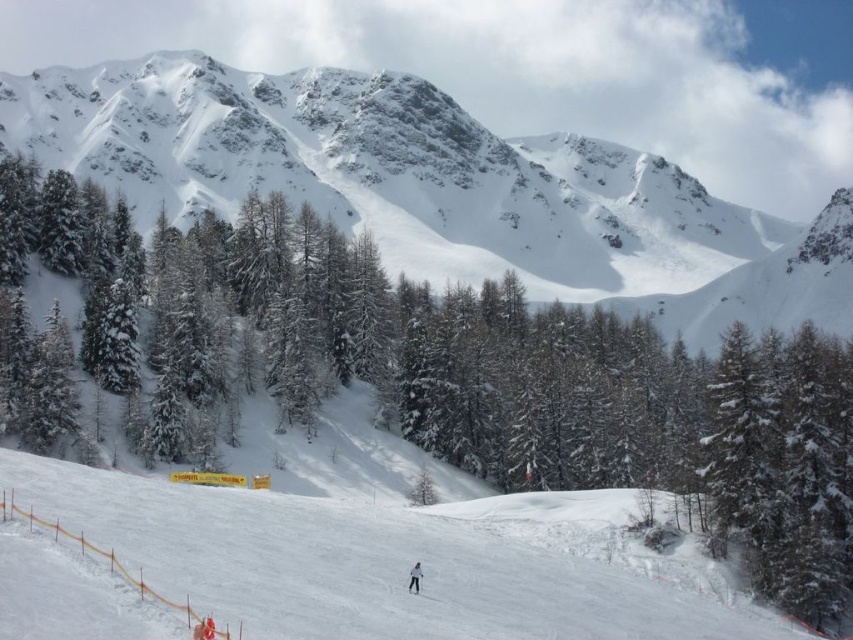
Is snowy granite mountain at upper center taller than white snow ski slope at lower center?

Yes, snowy granite mountain at upper center is taller than white snow ski slope at lower center.

Does snowy granite mountain at upper center have a lesser height compared to white snow ski slope at lower center?

In fact, snowy granite mountain at upper center may be taller than white snow ski slope at lower center.

Between point (300, 188) and point (219, 576), which one is positioned behind?

Point (300, 188)

Find the location of a particular element. Image resolution: width=853 pixels, height=640 pixels. snowy granite mountain at upper center is located at coordinates pyautogui.click(x=436, y=188).

Is white snowboarder at center taller than black matte ski at center?

Indeed, white snowboarder at center has a greater height compared to black matte ski at center.

Who is lower down, white snowboarder at center or black matte ski at center?

black matte ski at center is below.

What do you see at coordinates (415, 577) in the screenshot?
I see `white snowboarder at center` at bounding box center [415, 577].

Locate an element on the screen. The width and height of the screenshot is (853, 640). white snowboarder at center is located at coordinates (415, 577).

This screenshot has height=640, width=853. Describe the element at coordinates (436, 188) in the screenshot. I see `snowy granite mountain at upper center` at that location.

Can you confirm if snowy granite mountain at upper center is positioned below black matte ski at center?

Actually, snowy granite mountain at upper center is above black matte ski at center.

Where is `snowy granite mountain at upper center`? snowy granite mountain at upper center is located at coordinates (436, 188).